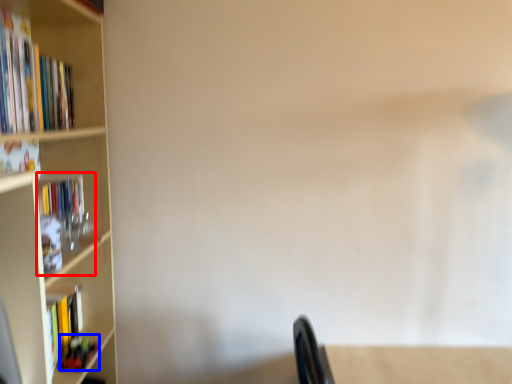
Question: Which point is closer to the camera, book (highlighted by a red box) or book (highlighted by a blue box)?

Choices:
 (A) book
 (B) book

Answer: (A)